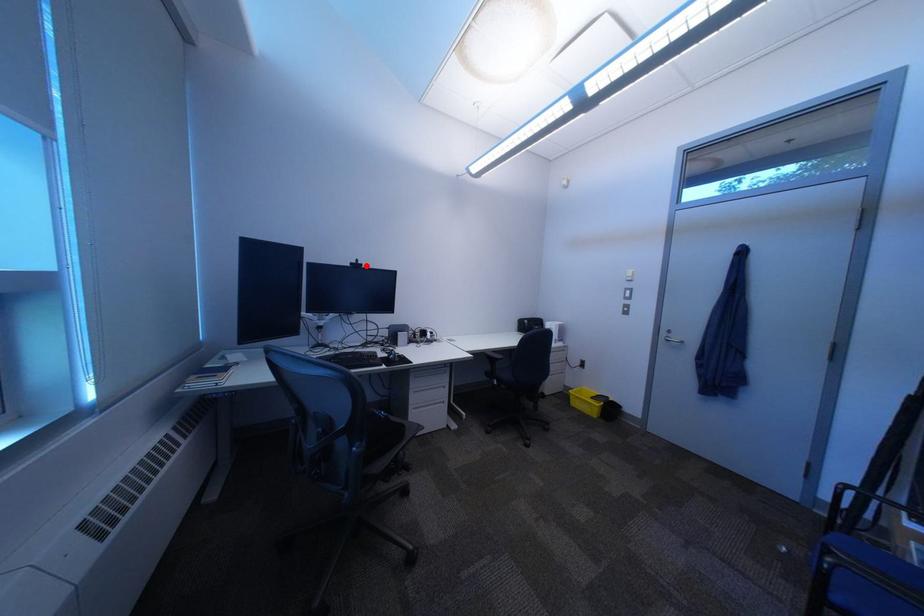
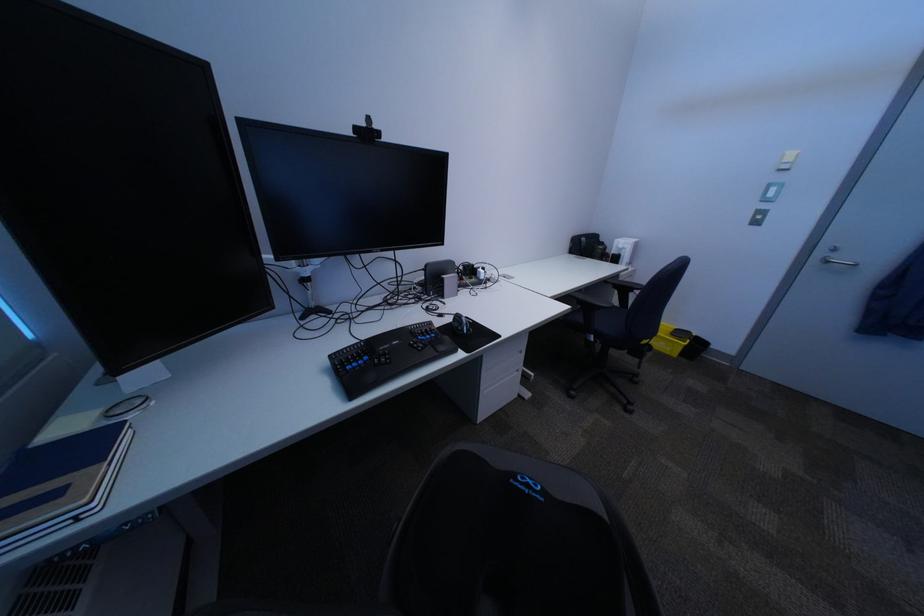
Locate, in the second image, the point that corresponds to the highlighted location in the first image.

(371, 131)